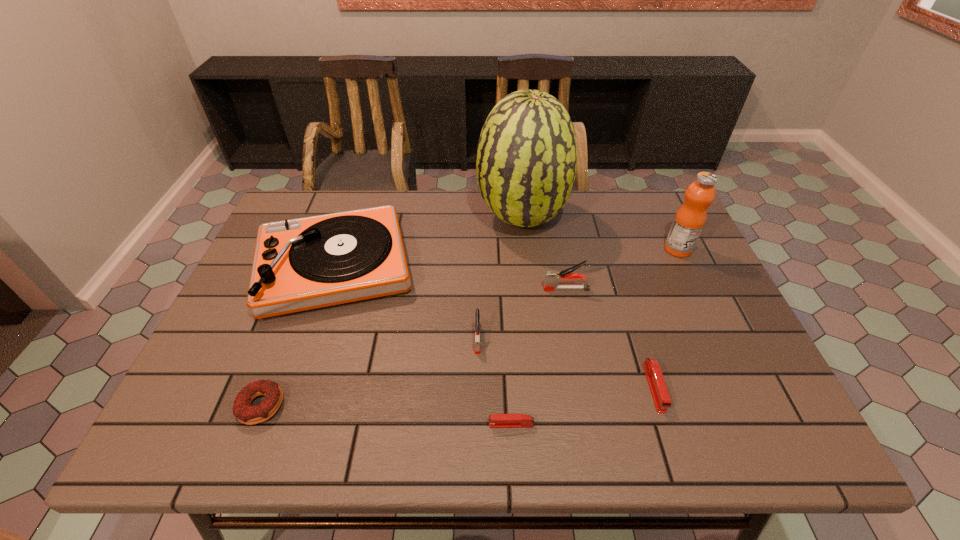
Choose which object is the fifth nearest neighbor to the right red stapler. Please provide its 2D coordinates. Your answer should be formatted as a tuple, i.e. [(x, y)], where the tuple contains the x and y coordinates of a point satisfying the conditions above.

[(526, 163)]

This screenshot has height=540, width=960. I want to click on object that is the second closest one to the record player, so click(526, 163).

Find the location of `stapler that is the third closest to the rightmost object`. stapler that is the third closest to the rightmost object is located at coordinates (477, 346).

At what (x,y) coordinates should I click in order to perform the action: click on stapler that is the third closest one to the bigger red stapler. Please return your answer as a coordinate pair (x, y). The height and width of the screenshot is (540, 960). Looking at the image, I should click on (477, 346).

Identify the location of free region that satisfies the following two spatial constraints: 1. on the front-facing side of the farther red stapler; 2. on the front-facing side of the shortest object. The image size is (960, 540). (665, 424).

Find the location of a particular element. The width and height of the screenshot is (960, 540). free space in the image that satisfies the following two spatial constraints: 1. on the front side of the rightmost object; 2. on the handle side of the right gray stapler is located at coordinates (697, 289).

Image resolution: width=960 pixels, height=540 pixels. I want to click on vacant space that satisfies the following two spatial constraints: 1. on the front-facing side of the farther red stapler; 2. on the front-facing side of the smaller red stapler, so click(x=665, y=424).

The image size is (960, 540). In order to click on free region that satisfies the following two spatial constraints: 1. on the back side of the watermelon; 2. on the right side of the doughnut in this screenshot , I will do `click(333, 218)`.

Where is `free region that satisfies the following two spatial constraints: 1. on the front side of the rightmost object; 2. on the front-facing side of the left red stapler`? free region that satisfies the following two spatial constraints: 1. on the front side of the rightmost object; 2. on the front-facing side of the left red stapler is located at coordinates pyautogui.click(x=761, y=424).